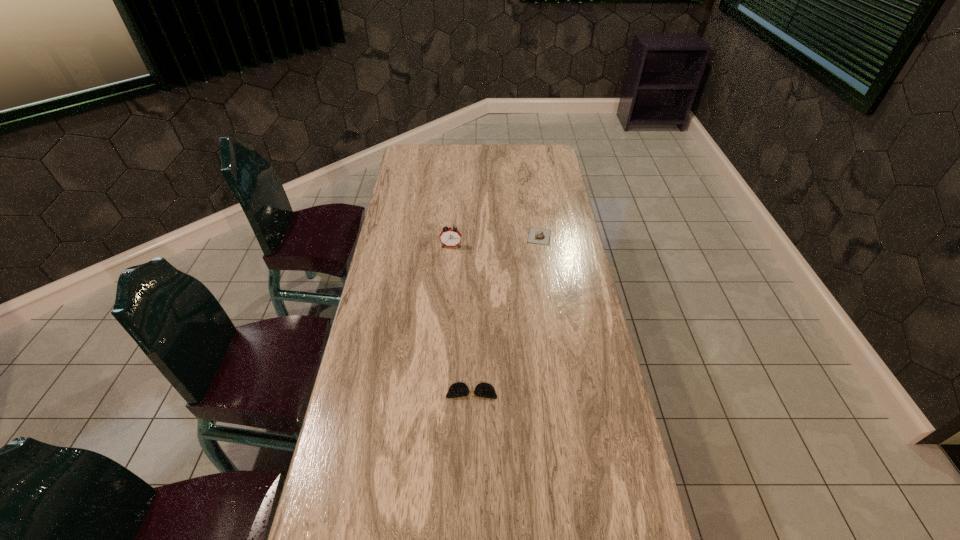
Locate an element on the screen. alarm clock is located at coordinates (450, 237).

Locate an element on the screen. The width and height of the screenshot is (960, 540). the second shortest object is located at coordinates (535, 236).

Where is `garlic`? The image size is (960, 540). garlic is located at coordinates (535, 236).

At what (x,y) coordinates should I click in order to perform the action: click on spectacles. Please return your answer as a coordinate pair (x, y). Image resolution: width=960 pixels, height=540 pixels. Looking at the image, I should click on (485, 390).

This screenshot has width=960, height=540. What are the coordinates of `the shortest object` in the screenshot? It's located at (485, 390).

Locate an element on the screen. vacant space positioned 0.100m on the clock face of the alarm clock is located at coordinates (449, 267).

Where is `free region located on the back of the garlic`? This screenshot has width=960, height=540. free region located on the back of the garlic is located at coordinates (532, 185).

Where is `free space located 0.150m on the front of the nearest object`? The width and height of the screenshot is (960, 540). free space located 0.150m on the front of the nearest object is located at coordinates (470, 454).

This screenshot has width=960, height=540. Identify the location of object at the right edge. (535, 236).

Find the location of a particular element. vacant space at the far edge is located at coordinates (473, 161).